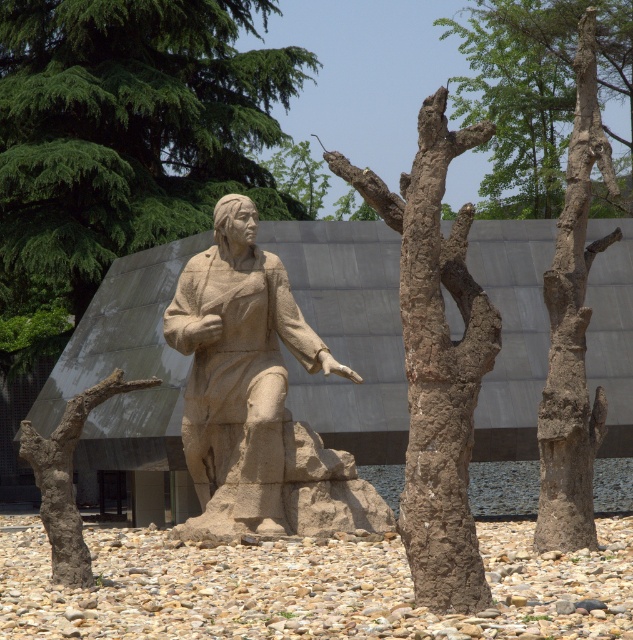
Based on the photo, you are an architect designing a garden path that needs to pass between the brown rough bark tree at upper right and the brown rough bark at right. Based on their heights, which tree should the path be closer to ensure better visibility?

The path should be closer to the brown rough bark tree at upper right since it has lesser height compared to the brown rough bark at right, providing better visibility.

You are an artist planning to paint the scene with the green textured tree at upper left and the green leafy tree at upper center. Which tree will appear closer to you in your painting?

The green textured tree at upper left will appear closer because it is positioned in front of the green leafy tree at upper center.